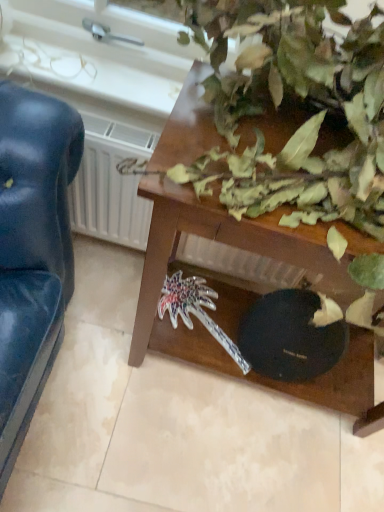
I want to click on vacant region in front of green leafy plant at upper right, so tap(199, 465).